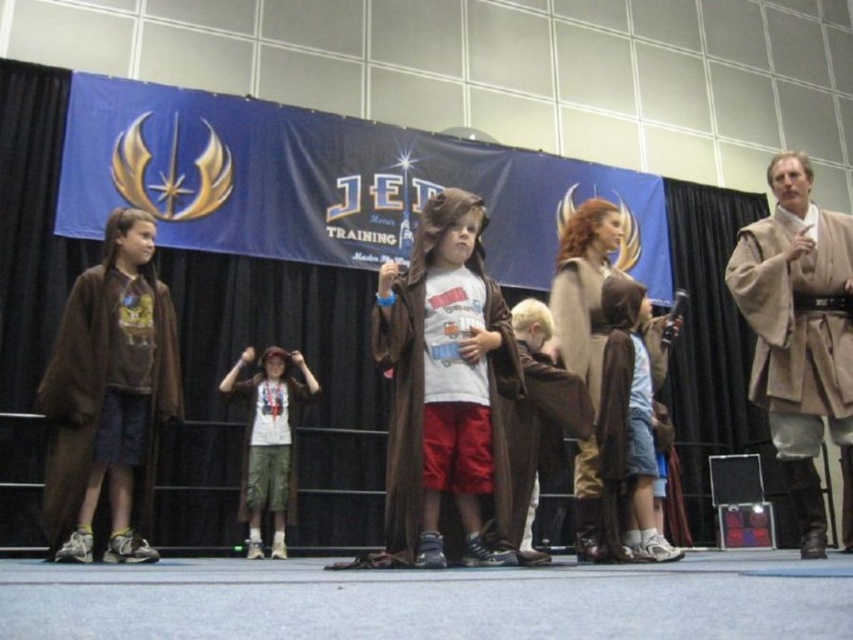
Who is positioned more to the right, brown suede cape at center or white cotton shirt at center?

Positioned to the right is brown suede cape at center.

Locate an element on the screen. Image resolution: width=853 pixels, height=640 pixels. brown suede cape at center is located at coordinates (628, 419).

The height and width of the screenshot is (640, 853). What are the coordinates of `brown suede cape at center` in the screenshot? It's located at (628, 419).

Is carpeted floor at lower center further to camera compared to brown suede cloak at center?

No.

From the picture: Is carpeted floor at lower center smaller than brown suede cloak at center?

Incorrect, carpeted floor at lower center is not smaller in size than brown suede cloak at center.

Locate an element on the screen. The image size is (853, 640). carpeted floor at lower center is located at coordinates (431, 600).

Does carpeted floor at lower center appear on the left side of white cotton shirt at center?

In fact, carpeted floor at lower center is to the right of white cotton shirt at center.

Between point (743, 612) and point (280, 557), which one is positioned behind?

The point (280, 557) is more distant.

At what (x,y) coordinates should I click in order to perform the action: click on carpeted floor at lower center. Please return your answer as a coordinate pair (x, y). Looking at the image, I should click on (431, 600).

This screenshot has height=640, width=853. Find the location of `carpeted floor at lower center`. carpeted floor at lower center is located at coordinates (431, 600).